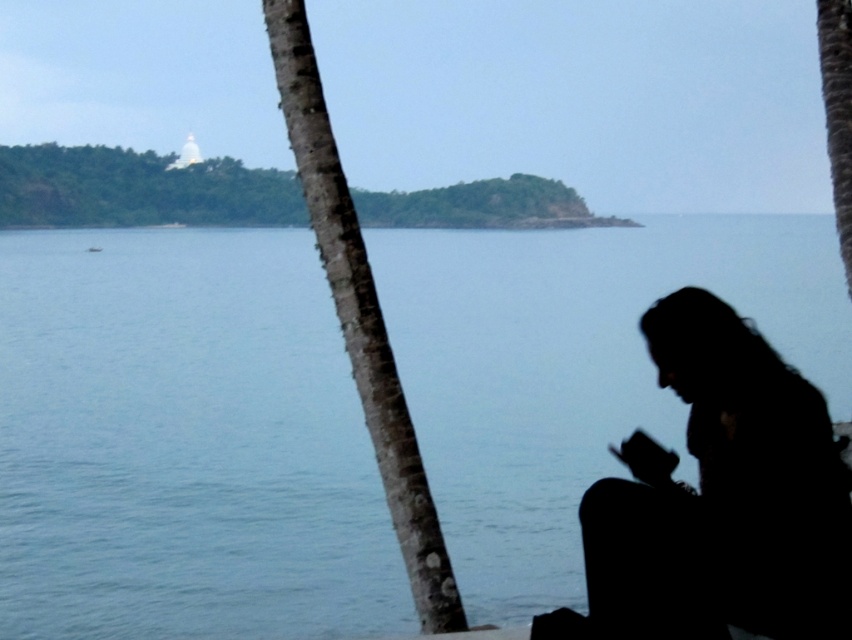
Question: Is blue water at center positioned behind silhouette hair at lower right?

Choices:
 (A) no
 (B) yes

Answer: (B)

Question: Considering the real-world distances, which object is farthest from the brown rough bark palm tree at center-left?

Choices:
 (A) silhouette hair at lower right
 (B) blue water at center

Answer: (B)

Question: Is blue water at center to the right of brown rough bark palm tree at center-left from the viewer's perspective?

Choices:
 (A) no
 (B) yes

Answer: (A)

Question: Which of the following is the farthest from the observer?

Choices:
 (A) (269, 262)
 (B) (309, 76)
 (C) (825, 440)

Answer: (A)

Question: Which is farther from the brown rough bark palm tree at center-left?

Choices:
 (A) blue water at center
 (B) silhouette hair at lower right

Answer: (A)

Question: Is silhouette hair at lower right thinner than brown rough bark palm tree at center-left?

Choices:
 (A) no
 (B) yes

Answer: (B)